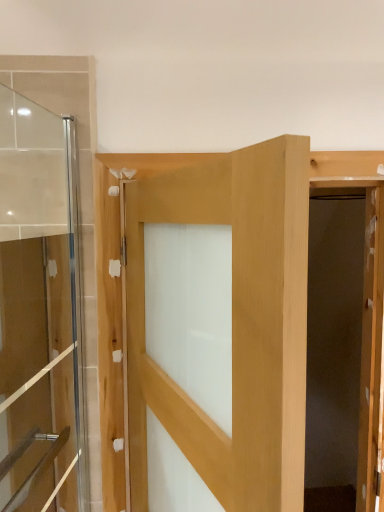
Question: From a real-world perspective, is natural wood door at center, the first door when ordered from right to left, physically located above or below transparent glass door at left, which is the 2th door from right to left?

Choices:
 (A) below
 (B) above

Answer: (A)

Question: Would you say natural wood door at center, the second door from the left, is inside or outside transparent glass door at left, the 1th door in the left-to-right sequence?

Choices:
 (A) outside
 (B) inside

Answer: (A)

Question: From the image's perspective, is natural wood door at center, the first door when ordered from right to left, above or below transparent glass door at left, which is the 2th door from right to left?

Choices:
 (A) above
 (B) below

Answer: (B)

Question: From a real-world perspective, is transparent glass door at left, which is the 2th door from right to left, positioned above or below natural wood door at center, the first door when ordered from right to left?

Choices:
 (A) above
 (B) below

Answer: (A)

Question: Is transparent glass door at left, the 1th door in the left-to-right sequence, wider or thinner than natural wood door at center, the first door when ordered from right to left?

Choices:
 (A) thin
 (B) wide

Answer: (A)

Question: In terms of height, does transparent glass door at left, which is the 2th door from right to left, look taller or shorter compared to natural wood door at center, the second door from the left?

Choices:
 (A) short
 (B) tall

Answer: (B)

Question: Considering the relative positions of transparent glass door at left, the 1th door in the left-to-right sequence, and natural wood door at center, the first door when ordered from right to left, in the image provided, is transparent glass door at left, the 1th door in the left-to-right sequence, to the left or to the right of natural wood door at center, the first door when ordered from right to left,?

Choices:
 (A) left
 (B) right

Answer: (A)